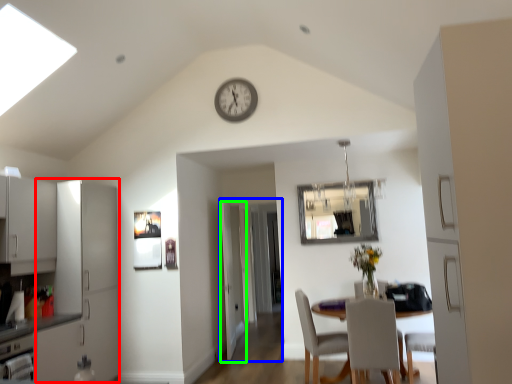
Question: Which object is the closest to the cabinetry (highlighted by a red box)? Choose among these: glass door (highlighted by a blue box) or door (highlighted by a green box).

Choices:
 (A) glass door
 (B) door

Answer: (B)